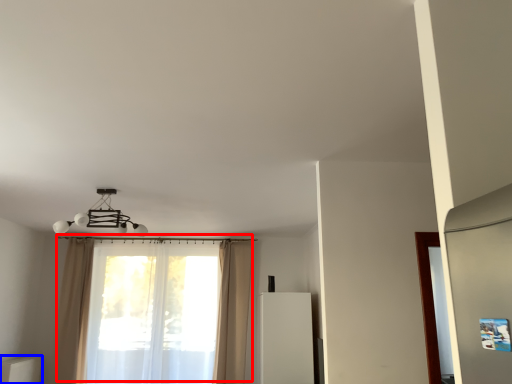
Question: Which point is further to the camera, curtain (highlighted by a red box) or furniture (highlighted by a blue box)?

Choices:
 (A) curtain
 (B) furniture

Answer: (A)